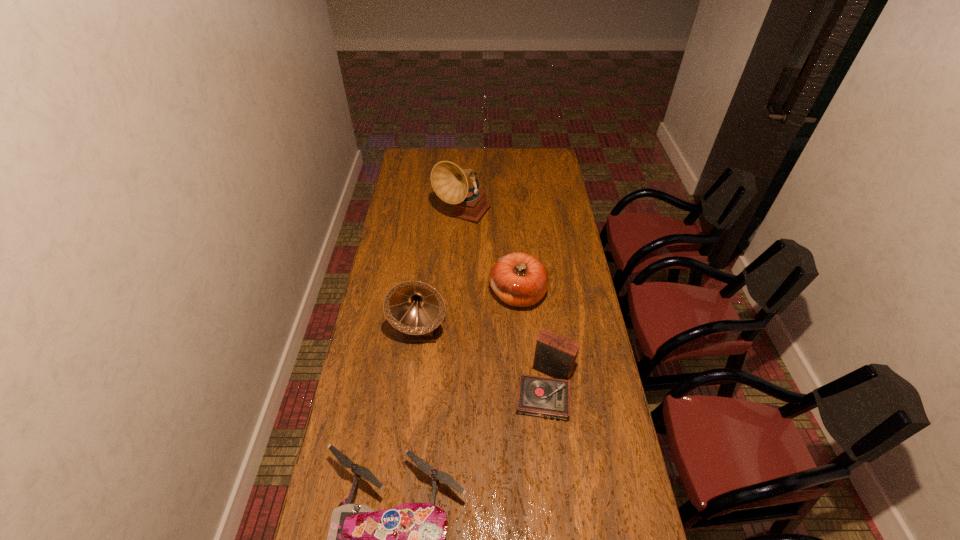
Identify the location of the farthest phonograph record. (450, 182).

I want to click on the farthest object, so click(450, 182).

Image resolution: width=960 pixels, height=540 pixels. I want to click on the second farthest phonograph record, so click(415, 308).

This screenshot has height=540, width=960. I want to click on the second tallest phonograph record, so click(415, 308).

The height and width of the screenshot is (540, 960). I want to click on pumpkin, so click(519, 279).

Locate an element on the screen. This screenshot has height=540, width=960. the rightmost phonograph record is located at coordinates (555, 355).

Where is `the fourth farthest object`? This screenshot has height=540, width=960. the fourth farthest object is located at coordinates (555, 355).

Find the location of `free space located on the horn of the tallest phonograph record`. free space located on the horn of the tallest phonograph record is located at coordinates (461, 275).

The height and width of the screenshot is (540, 960). I want to click on vacant space located on the horn of the fourth shortest object, so click(417, 365).

Identify the location of free location located 0.100m on the front of the pumpkin. (521, 336).